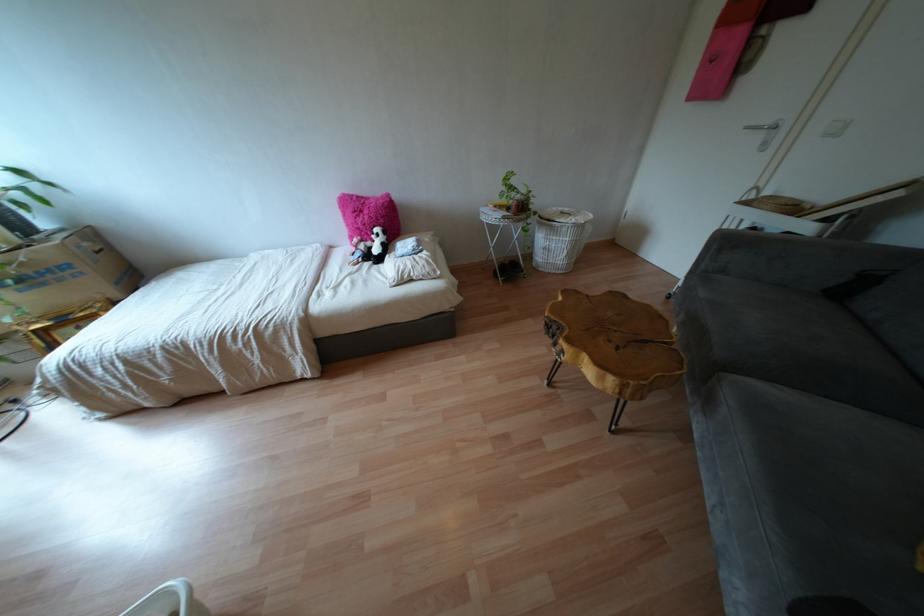
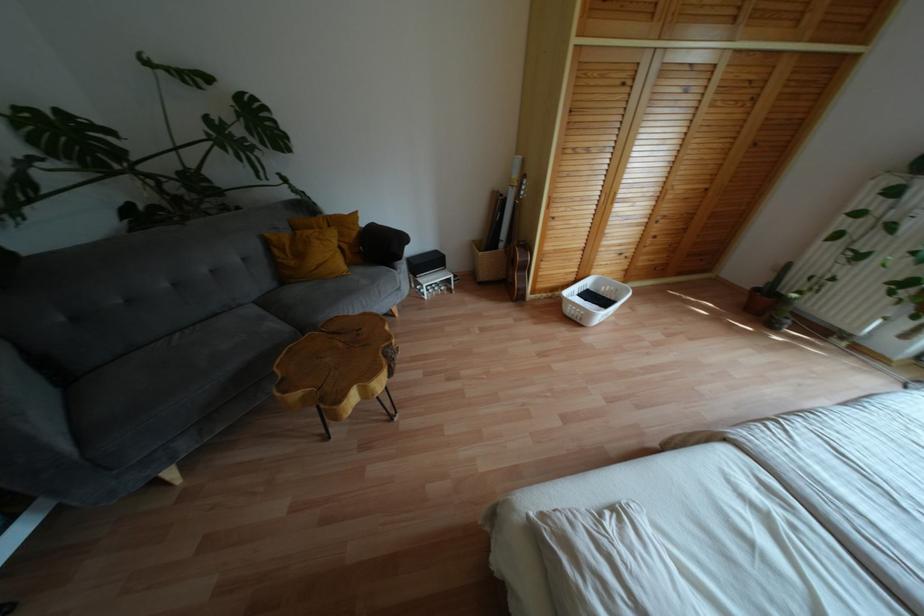
Locate, in the second image, the point that corresponds to (616,328) in the first image.

(341, 344)